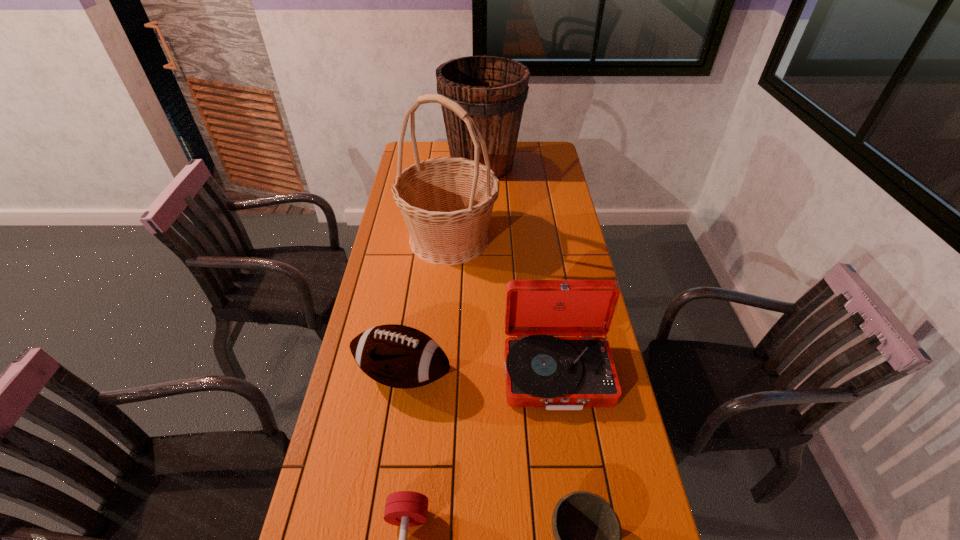
At what (x,y) coordinates should I click in order to perform the action: click on basket. Please return your answer as a coordinate pair (x, y). The height and width of the screenshot is (540, 960). Looking at the image, I should click on (446, 202).

Find the location of a particular element. the tallest object is located at coordinates (446, 202).

This screenshot has width=960, height=540. Find the location of `bucket`. bucket is located at coordinates (493, 90).

Find the location of a particular element. Image resolution: width=960 pixels, height=540 pixels. the farthest object is located at coordinates (493, 90).

At what (x,y) coordinates should I click in order to perform the action: click on the fourth shortest object. Please return your answer as a coordinate pair (x, y). The width and height of the screenshot is (960, 540). Looking at the image, I should click on (559, 373).

Find the location of a particular element. football (American) is located at coordinates (398, 356).

Where is `vacant space situated on the left of the basket`? The width and height of the screenshot is (960, 540). vacant space situated on the left of the basket is located at coordinates (385, 239).

You are a GUI agent. You are given a task and a screenshot of the screen. Output one action in this format:
    pyautogui.click(x=<x>, y=<y>)
    Task: Click on the vacant space located on the front of the bucket
    
    Given the screenshot: What is the action you would take?
    pyautogui.click(x=483, y=197)

The image size is (960, 540). In order to click on vacant area situated 0.050m on the front-facing side of the fourth shortest object in this screenshot , I will do `click(565, 431)`.

This screenshot has width=960, height=540. I want to click on vacant space located on the right of the third shortest object, so click(x=565, y=374).